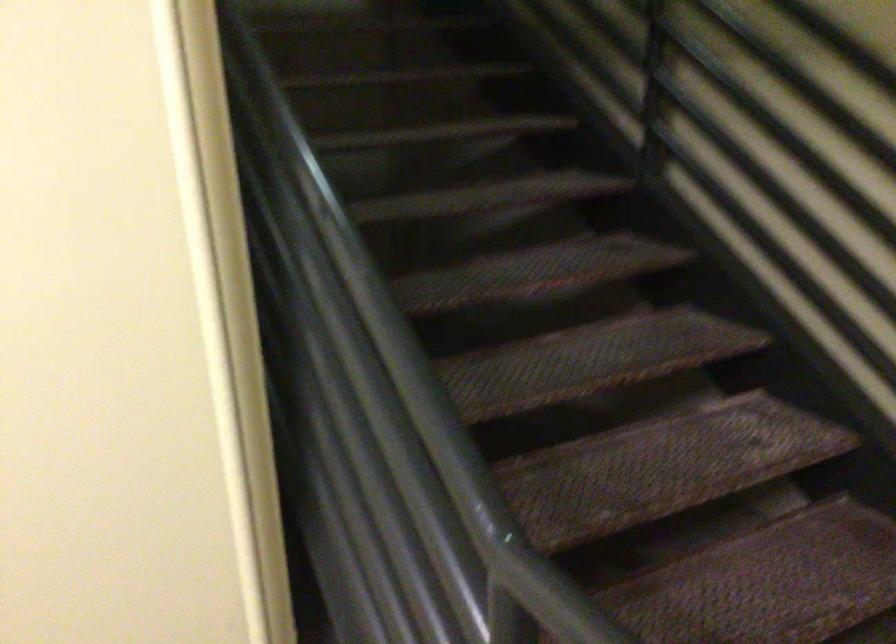
Identify the location of metal handrail. (383, 419).